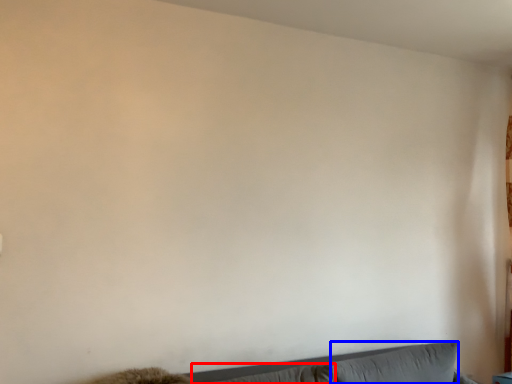
Question: Which point is closer to the camera, pillow (highlighted by a red box) or pillow (highlighted by a blue box)?

Choices:
 (A) pillow
 (B) pillow

Answer: (A)